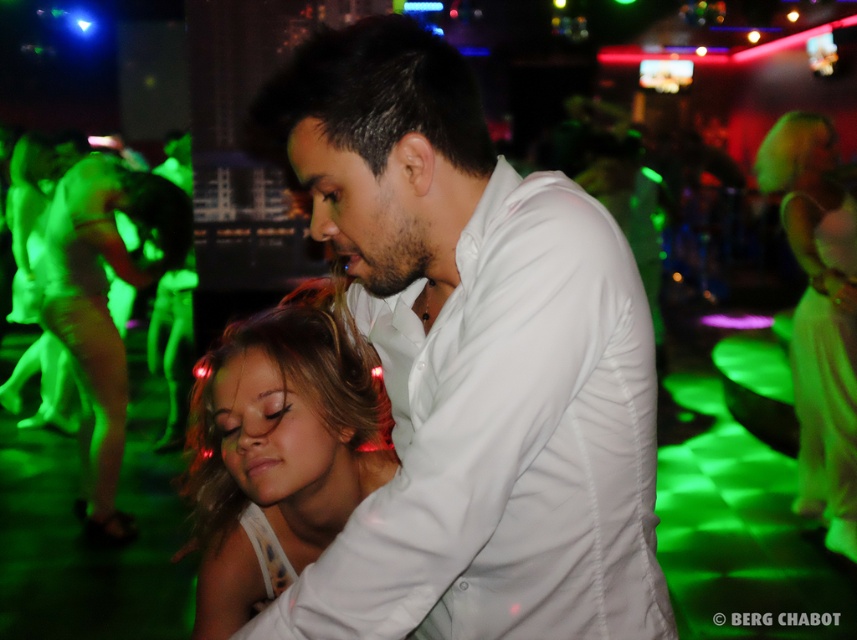
You are a photographer at the nightclub. You want to capture a closeup shot of both the white smooth shirt at center and the silky white dress at center in the same frame. Which object should you focus on first to ensure both are in the frame?

Since the white smooth shirt at center occupies less space than the silky white dress at center, you should focus on the silky white dress at center first to ensure both fit within the frame.

You are at the nightclub and want to find the matte green dress at left. Which direction should you look relative to the blonde hair at center?

The matte green dress at left is to the left of the blonde hair at center, so you should look to the left side of the blonde hair at center to find it.

You are a photographer standing at the entrance of the nightclub. You want to take a photo that includes both the white smooth shirt at center and the matte green dress at left. Considering their distance, will you need to zoom in or zoom out to ensure both are in frame?

The white smooth shirt at center and the matte green dress at left are 9.48 feet apart. To include both in the frame, you would need to zoom out to capture the distance between them.